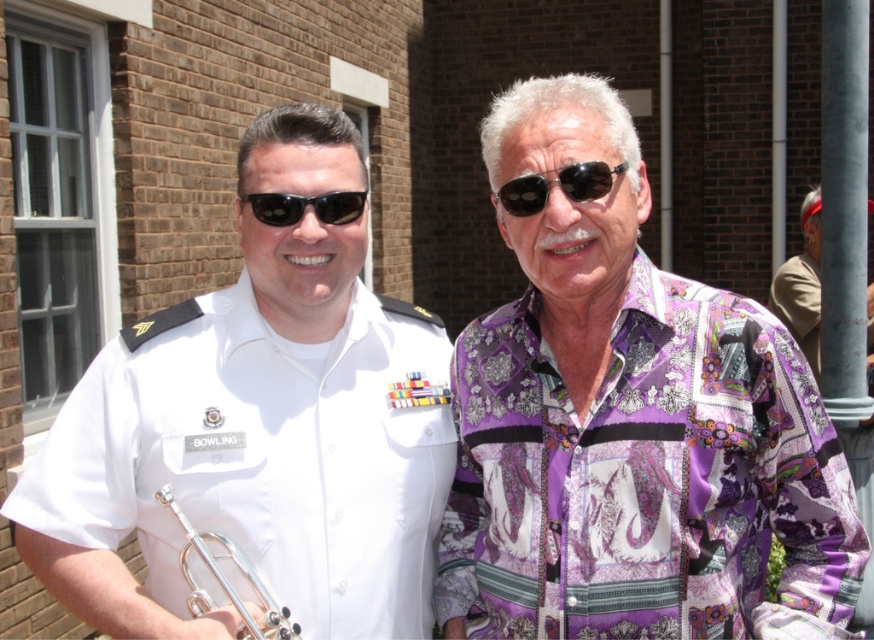
Is point (809, 200) more distant than point (212, 563)?

Yes, it is.

The image size is (874, 640). Find the location of `purple patterned shirt at right`. purple patterned shirt at right is located at coordinates (802, 284).

Which is in front, point (817, 301) or point (275, 609)?

Point (275, 609) is in front.

What are the coordinates of `purple patterned shirt at right` in the screenshot? It's located at [802, 284].

Between white uniform at center and black plastic sunglasses at center, which one has less height?

black plastic sunglasses at center is shorter.

Who is more forward, (382, 477) or (261, 204)?

Positioned in front is point (261, 204).

Where is `white uniform at center`? The height and width of the screenshot is (640, 874). white uniform at center is located at coordinates (255, 428).

This screenshot has height=640, width=874. I want to click on white uniform at center, so click(x=255, y=428).

Can you confirm if purple satin shirt at center is shorter than black plastic sunglasses at center?

No, purple satin shirt at center is not shorter than black plastic sunglasses at center.

Which is more to the right, purple satin shirt at center or black plastic sunglasses at center?

purple satin shirt at center is more to the right.

Locate an element on the screen. purple satin shirt at center is located at coordinates (629, 424).